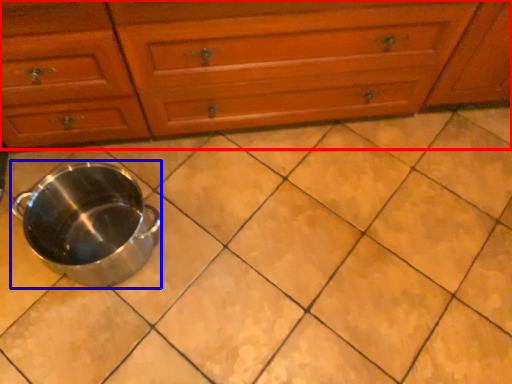
Question: Which object is closer to the camera taking this photo, chest of drawers (highlighted by a red box) or crock pot (highlighted by a blue box)?

Choices:
 (A) chest of drawers
 (B) crock pot

Answer: (A)